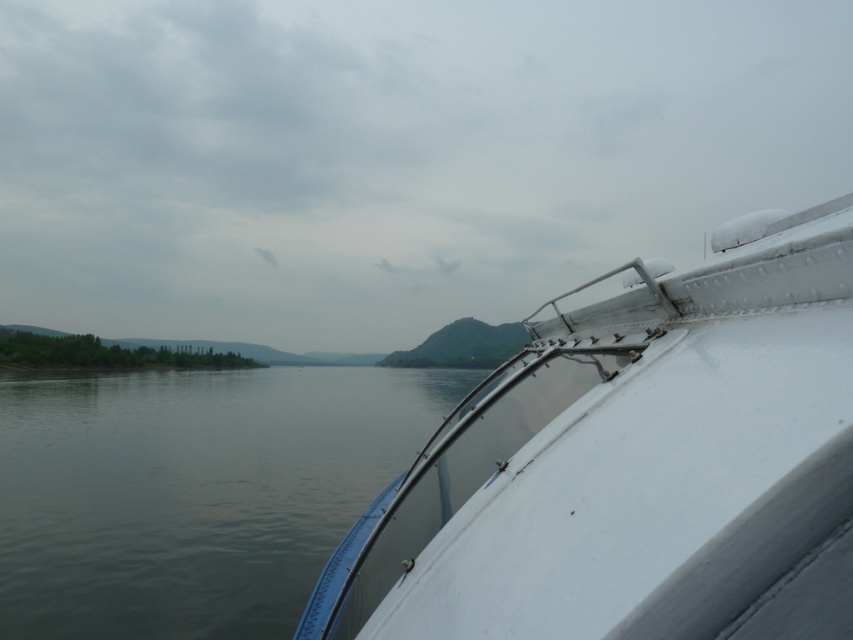
You are standing on the boat deck and want to take a photo that includes both the point at (x=744, y=97) and the point at (x=384, y=522). Which point should you focus on first to ensure both are in sharp focus?

You should focus on the point at (x=744, y=97) first because it is closer to the camera than the point at (x=384, y=522). This ensures that both points will be within the depth of field when focused on the closer object.